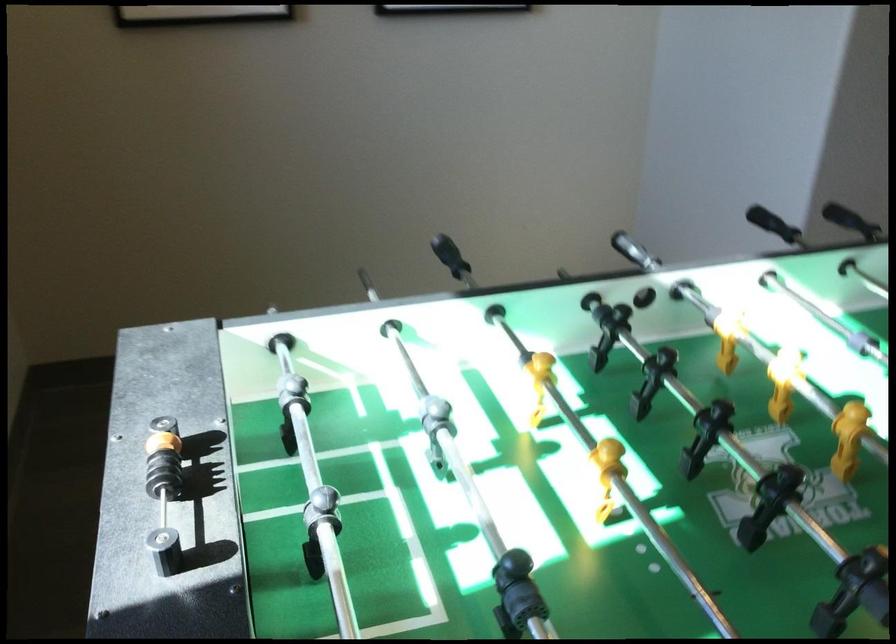
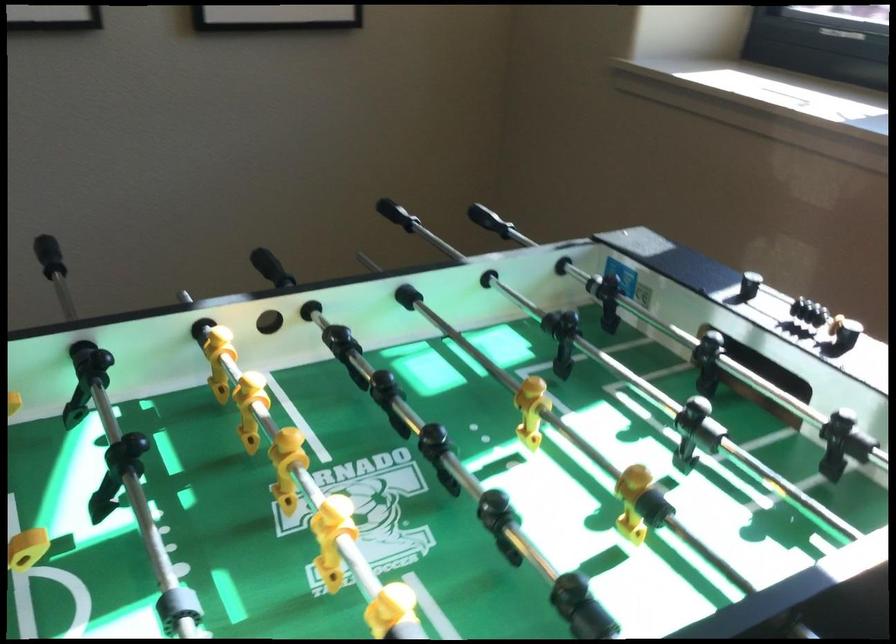
The point at (122, 498) is marked in the first image. Where is the corresponding point in the second image?

(798, 307)